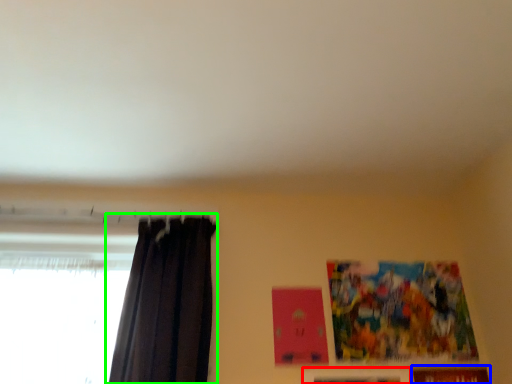
Question: Which is nearer to the picture frame (highlighted by a red box)? picture frame (highlighted by a blue box) or curtain (highlighted by a green box).

Choices:
 (A) picture frame
 (B) curtain

Answer: (A)